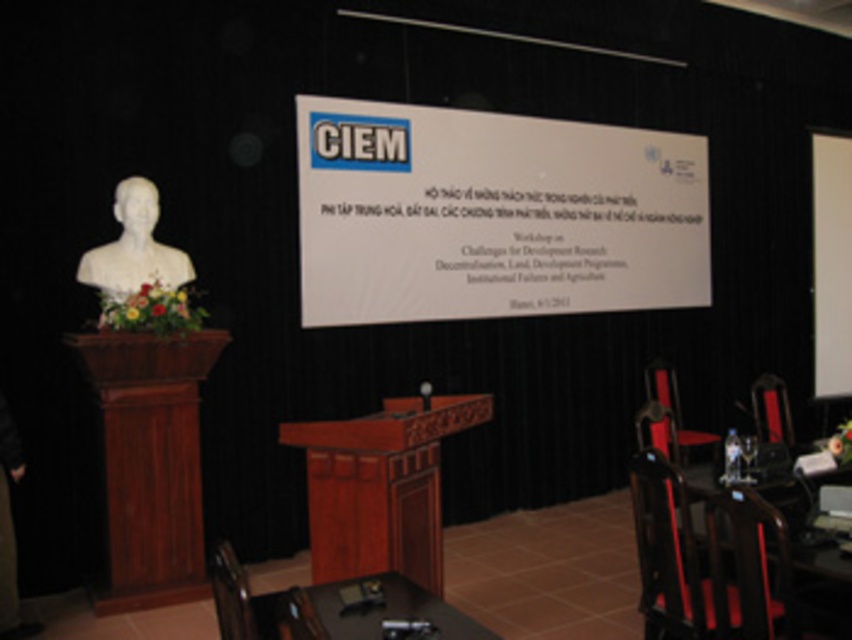
In the scene shown: What is the relationship between the width of the white matte projection screen at upper right and the matte black chair at right?

The white matte projection screen at upper right is thinner than the matte black chair at right.

You are an event organizer setting up for a presentation. You need to ensure that the white matte projection screen at upper right and the matte black chair at right are visible to all attendees. Considering their sizes, which object might require strategic placement to ensure visibility?

The white matte projection screen at upper right is smaller than the matte black chair at right, so the screen might need to be placed in a more prominent or elevated position to ensure it is clearly visible to all attendees.

You are an event organizer arranging seating for a presentation. You need to place a name tag on the chair that is to the right of the other. Which chair should you choose between the wooden chair at center and the matte black chair at center?

You should place the name tag on the matte black chair at center because the wooden chair at center is to the left of it, making the matte black chair at center the one on the right.